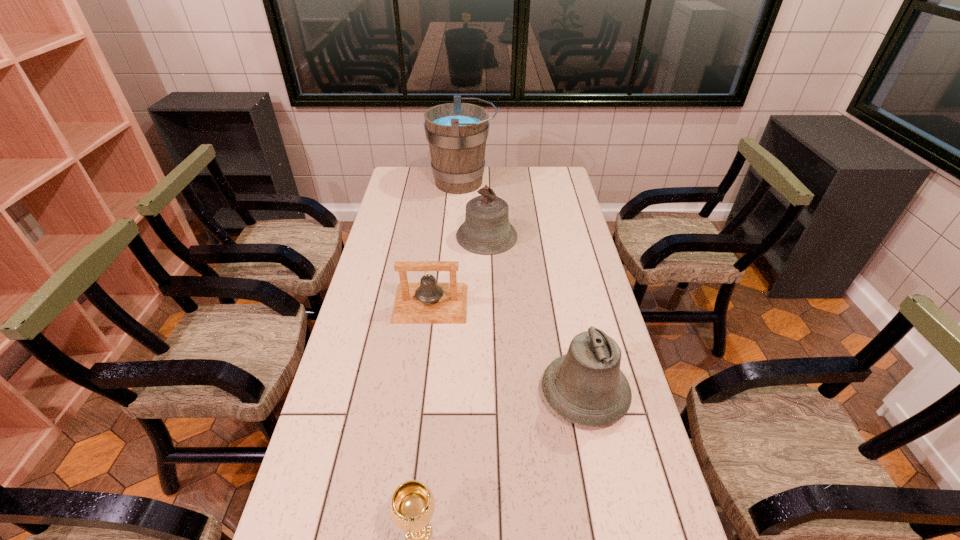
This screenshot has width=960, height=540. I want to click on vacant region between the second farthest bell and the rightmost bell, so click(508, 349).

At what (x,y) coordinates should I click in order to perform the action: click on empty location between the second farthest bell and the farthest object. Please return your answer as a coordinate pair (x, y). This screenshot has height=540, width=960. Looking at the image, I should click on (446, 243).

Where is `empty space that is in between the shortest bell and the wine bucket`? The image size is (960, 540). empty space that is in between the shortest bell and the wine bucket is located at coordinates (446, 243).

This screenshot has width=960, height=540. I want to click on free space between the third nearest object and the farthest bell, so click(459, 270).

The image size is (960, 540). Find the location of `the fourth closest object to the fourth farthest object`. the fourth closest object to the fourth farthest object is located at coordinates (457, 132).

You are a GUI agent. You are given a task and a screenshot of the screen. Output one action in this format:
    pyautogui.click(x=<x>, y=<y>)
    Task: Click on the object that can be found as the third closest to the farthest bell
    This screenshot has height=540, width=960.
    Given the screenshot: What is the action you would take?
    pyautogui.click(x=585, y=386)

Identify the location of the closest bell relative to the rightmost object. (427, 302).

I want to click on bell that is the closest to the second farthest object, so click(427, 302).

The height and width of the screenshot is (540, 960). Find the location of `vacant space that satisfies the following two spatial constraints: 1. on the back side of the shortest bell; 2. on the left side of the fourth nearest object`. vacant space that satisfies the following two spatial constraints: 1. on the back side of the shortest bell; 2. on the left side of the fourth nearest object is located at coordinates (439, 237).

Where is `blank area in the image that satisfies the following two spatial constraints: 1. with a handle on the side of the rightmost object; 2. on the right side of the tallest object`? Image resolution: width=960 pixels, height=540 pixels. blank area in the image that satisfies the following two spatial constraints: 1. with a handle on the side of the rightmost object; 2. on the right side of the tallest object is located at coordinates (450, 394).